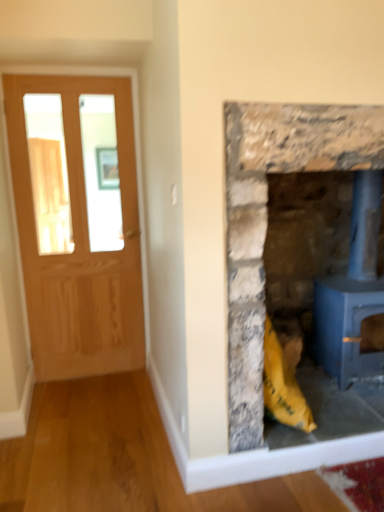
Question: Does matte wooden door at left appear on the right side of rustic stone fireplace at right?

Choices:
 (A) no
 (B) yes

Answer: (A)

Question: Is rustic stone fireplace at right surrounded by matte wooden door at left?

Choices:
 (A) yes
 (B) no

Answer: (B)

Question: From a real-world perspective, is matte wooden door at left located beneath rustic stone fireplace at right?

Choices:
 (A) yes
 (B) no

Answer: (B)

Question: Considering the relative sizes of matte wooden door at left and rustic stone fireplace at right in the image provided, is matte wooden door at left thinner than rustic stone fireplace at right?

Choices:
 (A) yes
 (B) no

Answer: (A)

Question: Is matte wooden door at left oriented towards rustic stone fireplace at right?

Choices:
 (A) yes
 (B) no

Answer: (B)

Question: Is matte wooden door at left turned away from rustic stone fireplace at right?

Choices:
 (A) yes
 (B) no

Answer: (B)

Question: Considering the relative positions of matte wooden door at left and blue painted metal wood burning stove at right in the image provided, is matte wooden door at left to the right of blue painted metal wood burning stove at right from the viewer's perspective?

Choices:
 (A) no
 (B) yes

Answer: (A)

Question: Is blue painted metal wood burning stove at right a part of matte wooden door at left?

Choices:
 (A) no
 (B) yes

Answer: (A)

Question: Could you tell me if matte wooden door at left is turned towards blue painted metal wood burning stove at right?

Choices:
 (A) no
 (B) yes

Answer: (A)

Question: Can you confirm if matte wooden door at left is shorter than blue painted metal wood burning stove at right?

Choices:
 (A) no
 (B) yes

Answer: (A)

Question: From a real-world perspective, is matte wooden door at left located higher than blue painted metal wood burning stove at right?

Choices:
 (A) yes
 (B) no

Answer: (A)

Question: Would you say matte wooden door at left is a long distance from blue painted metal wood burning stove at right?

Choices:
 (A) no
 (B) yes

Answer: (B)

Question: From the image's perspective, is rustic stone fireplace at right over matte wooden door at left?

Choices:
 (A) no
 (B) yes

Answer: (A)